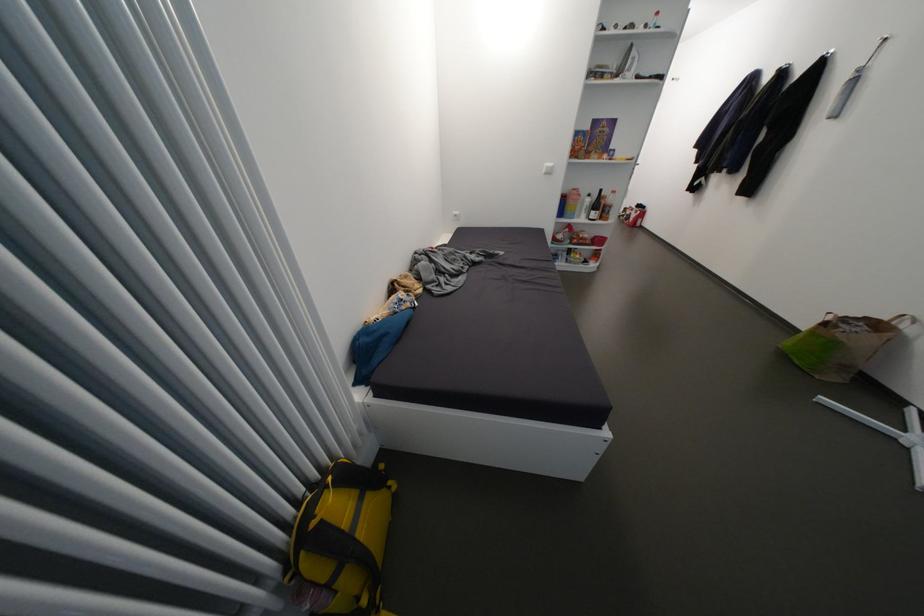
Find where to lift the white spray bottle. Please return your answer as a coordinate pair (x, y).

(585, 206)